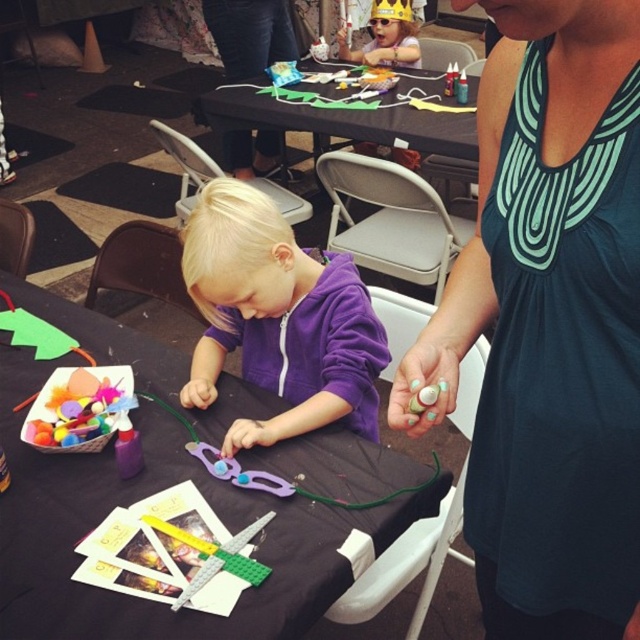
This screenshot has height=640, width=640. Describe the element at coordinates (548, 323) in the screenshot. I see `teal fabric tank top at upper right` at that location.

Image resolution: width=640 pixels, height=640 pixels. Describe the element at coordinates (548, 323) in the screenshot. I see `teal fabric tank top at upper right` at that location.

The height and width of the screenshot is (640, 640). Find the location of `teal fabric tank top at upper right`. teal fabric tank top at upper right is located at coordinates (548, 323).

Which is behind, point (333, 324) or point (378, 60)?

The point (378, 60) is more distant.

Does purple fleece hoodie at center appear on the left side of matte purple hoodie at center?

Correct, you'll find purple fleece hoodie at center to the left of matte purple hoodie at center.

Describe the element at coordinates (276, 317) in the screenshot. I see `purple fleece hoodie at center` at that location.

The height and width of the screenshot is (640, 640). Find the location of `purple fleece hoodie at center`. purple fleece hoodie at center is located at coordinates (276, 317).

Between matte purple hoodie at center and purple plastic scissors at center, which one has less height?

purple plastic scissors at center is shorter.

Between matte purple hoodie at center and purple plastic scissors at center, which one is positioned higher?

Positioned higher is matte purple hoodie at center.

Between point (376, 16) and point (193, 452), which one is positioned behind?

Point (376, 16)

Locate an element on the screen. This screenshot has width=640, height=640. matte purple hoodie at center is located at coordinates (385, 36).